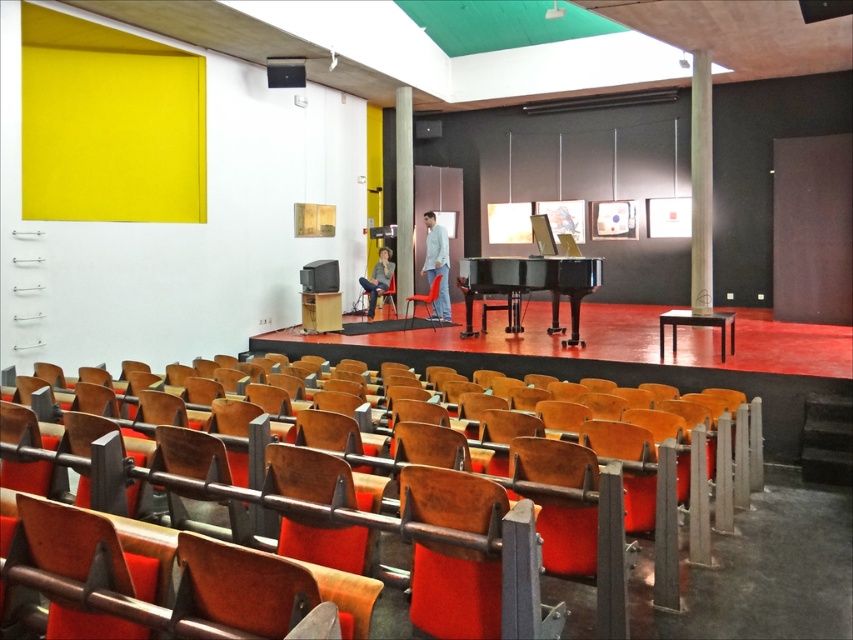
Between black glossy piano at center and white matte shirt at center, which one has more height?

Standing taller between the two is white matte shirt at center.

Can you confirm if black glossy piano at center is shorter than white matte shirt at center?

Yes, black glossy piano at center is shorter than white matte shirt at center.

Who is more distant from viewer, (550, 289) or (438, 294)?

The point (438, 294) is more distant.

Where is `black glossy piano at center`? black glossy piano at center is located at coordinates point(531,285).

Which is more to the left, white matte shirt at center or wooden chair at center?

From the viewer's perspective, wooden chair at center appears more on the left side.

Is white matte shirt at center smaller than wooden chair at center?

Indeed, white matte shirt at center has a smaller size compared to wooden chair at center.

Where is `white matte shirt at center`? Image resolution: width=853 pixels, height=640 pixels. white matte shirt at center is located at coordinates (436, 264).

Is wooden seat at lower center thinner than white matte shirt at center?

No.

Who is positioned more to the left, wooden seat at lower center or white matte shirt at center?

Positioned to the left is wooden seat at lower center.

This screenshot has height=640, width=853. Describe the element at coordinates (225, 490) in the screenshot. I see `wooden seat at lower center` at that location.

Find the location of a particular element. Image resolution: width=853 pixels, height=640 pixels. wooden seat at lower center is located at coordinates (225, 490).